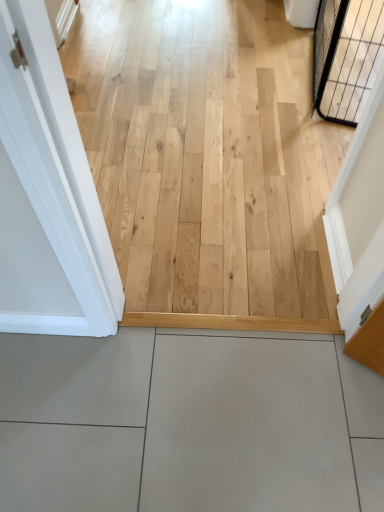
The width and height of the screenshot is (384, 512). What do you see at coordinates (346, 56) in the screenshot?
I see `clear glass gate at upper right` at bounding box center [346, 56].

This screenshot has height=512, width=384. Find the location of `clear glass gate at upper right`. clear glass gate at upper right is located at coordinates coord(346,56).

This screenshot has width=384, height=512. I want to click on clear glass gate at upper right, so click(346, 56).